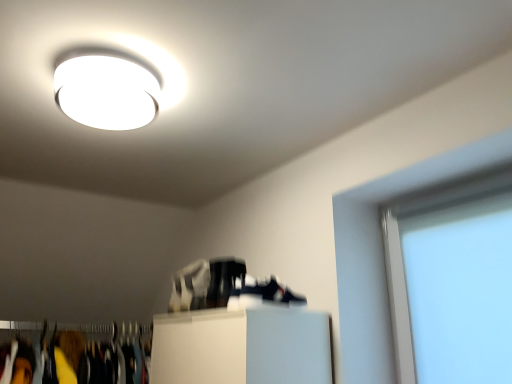
Question: Does transparent glass window screen at right have a lesser width compared to white glossy ceiling light at upper center?

Choices:
 (A) yes
 (B) no

Answer: (A)

Question: Is transparent glass window screen at right shorter than white glossy ceiling light at upper center?

Choices:
 (A) yes
 (B) no

Answer: (B)

Question: Are transparent glass window screen at right and white glossy ceiling light at upper center making contact?

Choices:
 (A) no
 (B) yes

Answer: (A)

Question: Is transparent glass window screen at right not near white glossy ceiling light at upper center?

Choices:
 (A) yes
 (B) no

Answer: (A)

Question: Does transparent glass window screen at right lie in front of white glossy ceiling light at upper center?

Choices:
 (A) no
 (B) yes

Answer: (A)

Question: From a real-world perspective, does transparent glass window screen at right stand above white glossy ceiling light at upper center?

Choices:
 (A) yes
 (B) no

Answer: (B)

Question: Considering the relative sizes of white glossy ceiling light at upper center and transparent glass window screen at right in the image provided, is white glossy ceiling light at upper center smaller than transparent glass window screen at right?

Choices:
 (A) yes
 (B) no

Answer: (A)

Question: Can you confirm if white glossy ceiling light at upper center is positioned to the right of transparent glass window screen at right?

Choices:
 (A) no
 (B) yes

Answer: (A)

Question: Is white glossy ceiling light at upper center not close to transparent glass window screen at right?

Choices:
 (A) yes
 (B) no

Answer: (A)

Question: Considering the relative positions of white glossy ceiling light at upper center and transparent glass window screen at right in the image provided, is white glossy ceiling light at upper center behind transparent glass window screen at right?

Choices:
 (A) no
 (B) yes

Answer: (A)

Question: Is transparent glass window screen at right at the back of white glossy ceiling light at upper center?

Choices:
 (A) yes
 (B) no

Answer: (B)

Question: Is white glossy ceiling light at upper center next to transparent glass window screen at right?

Choices:
 (A) no
 (B) yes

Answer: (A)

Question: Is transparent glass window screen at right closer to the viewer compared to white matte shoe at center, the 2th shoe positioned from the front?

Choices:
 (A) no
 (B) yes

Answer: (B)